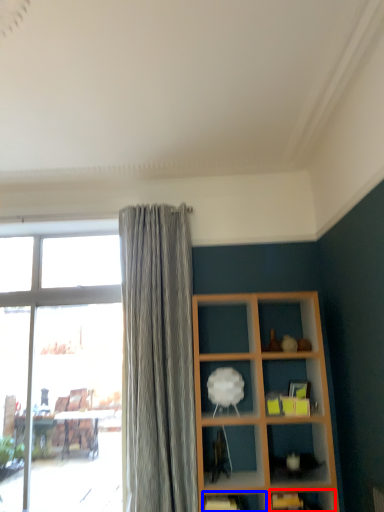
Question: Which object appears closest to the camera in this image, shelf (highlighted by a red box) or shelf (highlighted by a blue box)?

Choices:
 (A) shelf
 (B) shelf

Answer: (A)